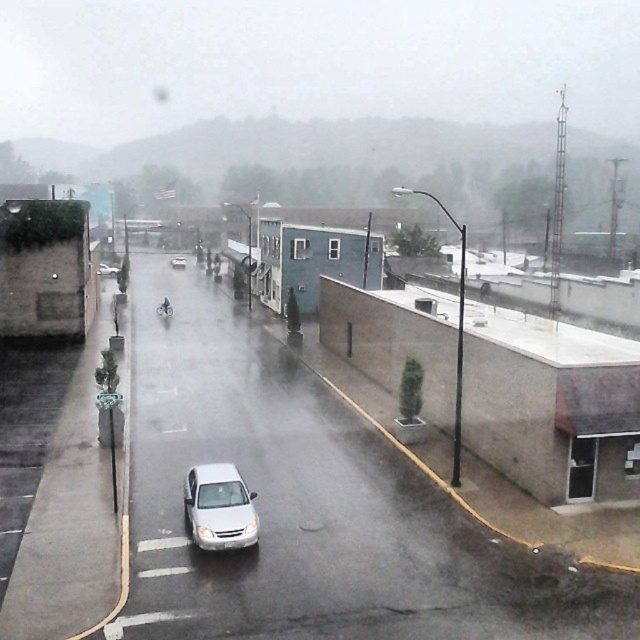
In the scene shown: You are a delivery person needing to park your 1.8 meters tall delivery box in the space between the white glossy sedan at center and the white matte sedan at center. Can the delivery box fit vertically between them?

The white glossy sedan at center has a lesser height compared to white matte sedan at center. The height difference between them is not specified, so it is uncertain if the 1.8 meters tall delivery box can fit vertically between them.

You are standing at the corner of the street and want to cross to the other side. The white glossy sedan at center is blocking your path. Can you walk around it safely if you stay within the pedestrian zone?

The white glossy sedan at center is located at point (218, 508). Since the sedan is parked on the right side of the street, you can safely walk around it within the pedestrian zone on the left side of the road.

You are standing on a balcony overlooking a rainy street. You notice two vehicles, a white matte sedan at center and a white matte car at center. Which one is positioned to the left of the other?

The white matte sedan at center is positioned to the left of the white matte car at center.